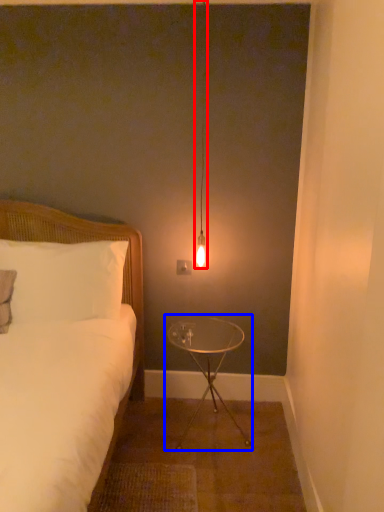
Question: Which object appears closest to the camera in this image, lamp (highlighted by a red box) or table (highlighted by a blue box)?

Choices:
 (A) lamp
 (B) table

Answer: (A)